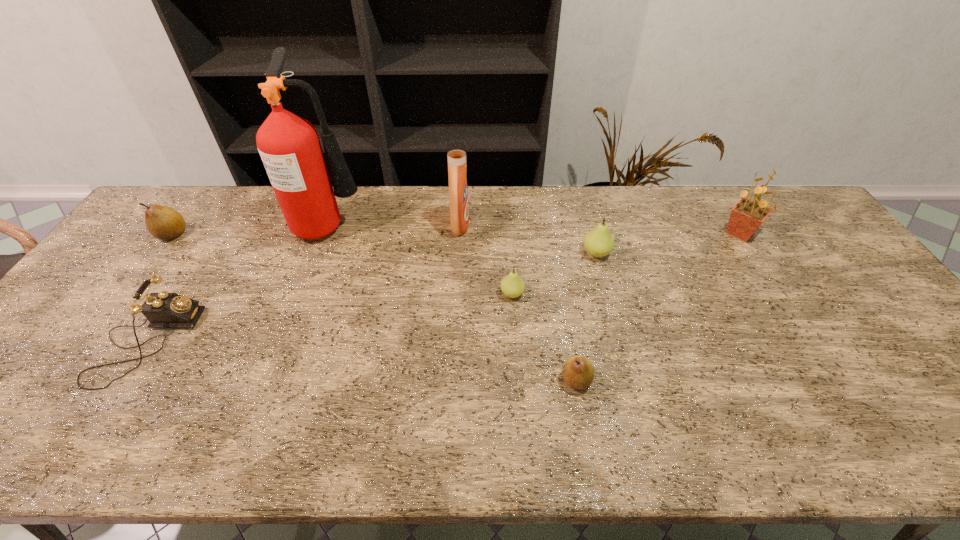
You are a GUI agent. You are given a task and a screenshot of the screen. Output one action in this format:
    pyautogui.click(x=<x>, y=<y>)
    Task: Click on the red fire extinguisher
    This screenshot has width=960, height=540.
    Given the screenshot: What is the action you would take?
    pyautogui.click(x=289, y=146)

Locate an element on the screen. fire extinguisher is located at coordinates pyautogui.click(x=289, y=146).

Identify the location of detergent. Image resolution: width=960 pixels, height=540 pixels. (456, 152).

I want to click on the second tallest object, so click(x=456, y=152).

At what (x,y) coordinates should I click in order to perform the action: click on the rightmost object. Please return your answer as a coordinate pair (x, y). Looking at the image, I should click on (747, 215).

Where is `the third tallest object`? the third tallest object is located at coordinates (747, 215).

At what (x,y) coordinates should I click in order to perform the action: click on the seventh object from left to right. Please return your answer as a coordinate pair (x, y). The image size is (960, 540). Looking at the image, I should click on (598, 242).

Find the location of `the rightmost pear`. the rightmost pear is located at coordinates (598, 242).

Locate an element on the screen. the bigger brown pear is located at coordinates (164, 223).

I want to click on the left brown pear, so click(164, 223).